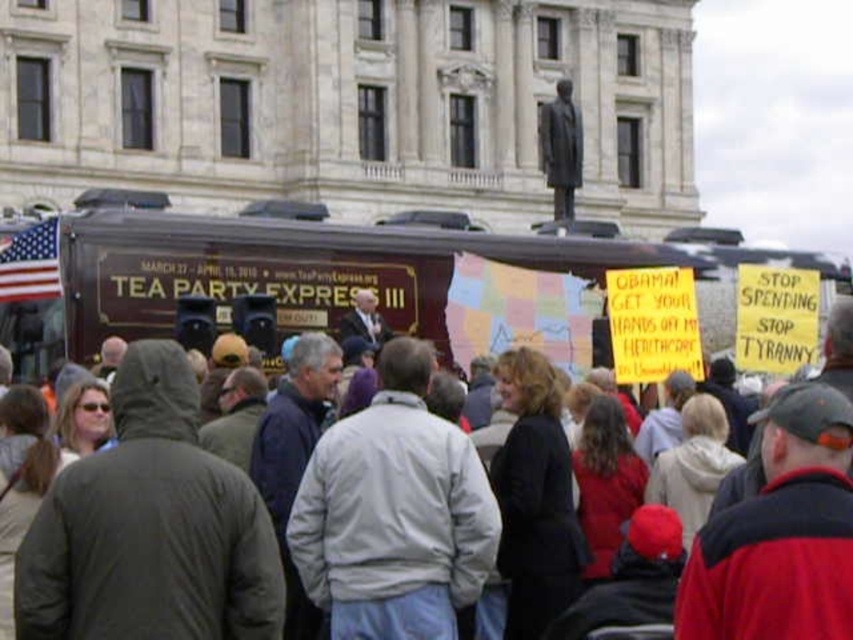
You are a photographer standing in the crowd at the protest. You want to take a photo of the maroon polished wood tour bus at center and the gray wool jacket at center. Which object should you zoom in on to capture both in the frame without moving your camera?

You should zoom in on the gray wool jacket at center because the maroon polished wood tour bus at center occupies less space, so it will be smaller and easier to fit both into the frame.

You are standing at the back of the crowd and want to get a better view of the speaker. Which object between the maroon polished wood tour bus at center and the gray fabric jacket at center is closer to you, and why?

The maroon polished wood tour bus at center is closer to you because it is further to the viewer than the gray fabric jacket at center, meaning it blocks your view of the jacket.